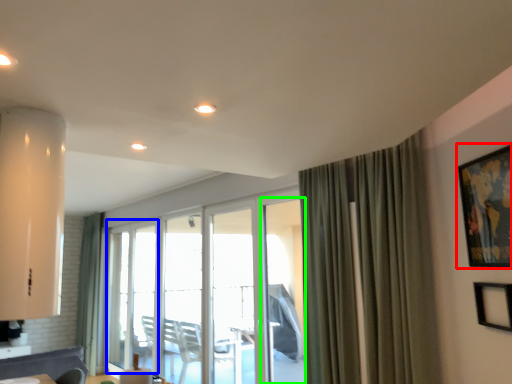
Question: Which object is the farthest from picture frame (highlighted by a red box)? Choose among these: glass door (highlighted by a blue box) or screen door (highlighted by a green box).

Choices:
 (A) glass door
 (B) screen door

Answer: (A)